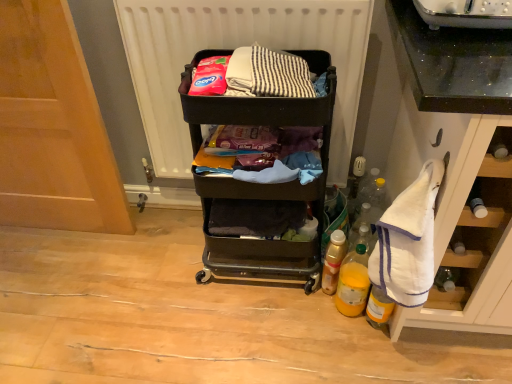
Question: Looking at the image, does translucent plastic bottle at lower right, the 1th bottle positioned from the left, seem bigger or smaller compared to white terry cloth towel at right?

Choices:
 (A) small
 (B) big

Answer: (A)

Question: Considering the positions of translucent plastic bottle at lower right, the 1th bottle positioned from the left, and white terry cloth towel at right in the image, is translucent plastic bottle at lower right, the 1th bottle positioned from the left, wider or thinner than white terry cloth towel at right?

Choices:
 (A) wide
 (B) thin

Answer: (B)

Question: Estimate the real-world distances between objects in this image. Which object is closer to the translucent plastic bottle at lower right, the third bottle positioned from the right?

Choices:
 (A) yellow translucent bottle at lower right, arranged as the 3th bottle when viewed from the left
 (B) white terry cloth towel at right
 (C) black plastic cart at center
 (D) white matte radiator at upper center
 (E) wooden at left

Answer: (A)

Question: Based on their relative distances, which object is nearer to the white matte radiator at upper center?

Choices:
 (A) translucent plastic bottle at lower right, the 1th bottle positioned from the left
 (B) wooden at left
 (C) yellow translucent bottle at lower right, the first bottle viewed from the right
 (D) black plastic cart at center
 (E) yellow matte bottle at lower right, arranged as the second bottle when viewed from the left

Answer: (D)